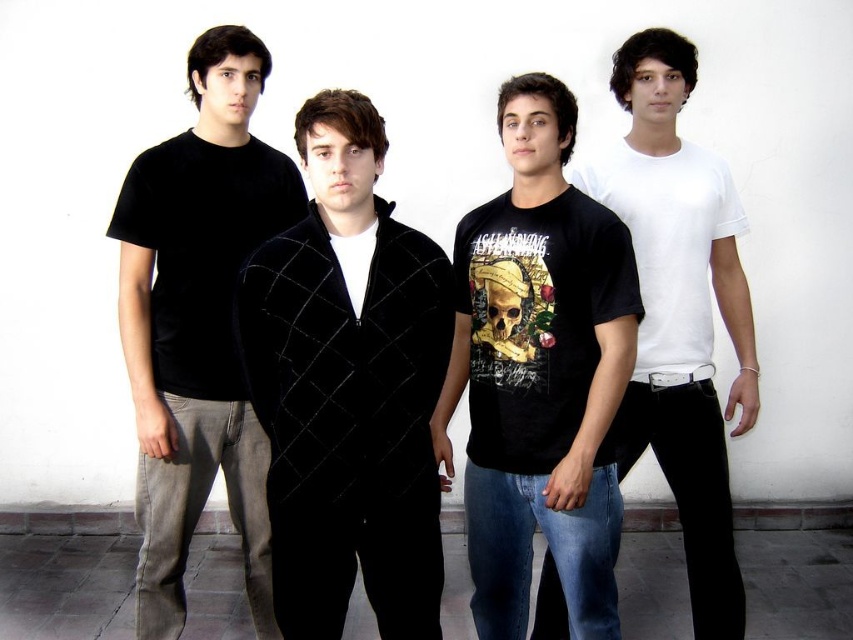
Question: Which point is closer to the camera?

Choices:
 (A) white matte t-shirt at center
 (B) velvet black jacket at center
 (C) black velvet t-shirt at left
 (D) black matte t-shirt at center

Answer: (B)

Question: Can you confirm if velvet black jacket at center is positioned below white matte t-shirt at center?

Choices:
 (A) yes
 (B) no

Answer: (A)

Question: From the image, what is the correct spatial relationship of velvet black jacket at center in relation to black velvet t-shirt at left?

Choices:
 (A) below
 (B) above

Answer: (A)

Question: Is velvet black jacket at center smaller than white matte t-shirt at center?

Choices:
 (A) yes
 (B) no

Answer: (A)

Question: Which point is farther to the camera?

Choices:
 (A) white matte t-shirt at center
 (B) black velvet t-shirt at left
 (C) black matte t-shirt at center
 (D) velvet black jacket at center

Answer: (A)

Question: Which point appears closest to the camera in this image?

Choices:
 (A) (680, 36)
 (B) (578, 406)
 (C) (413, 269)

Answer: (C)